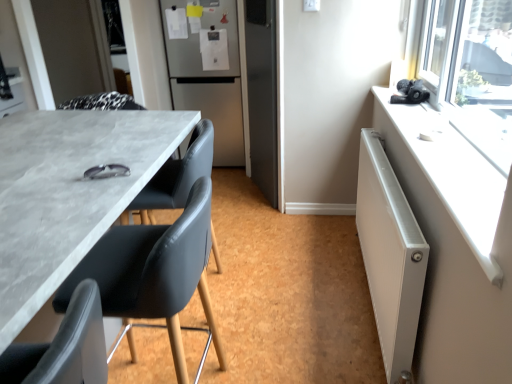
This screenshot has width=512, height=384. Describe the element at coordinates (154, 273) in the screenshot. I see `matte black chair at left, positioned as the second chair in front-to-back order` at that location.

What do you see at coordinates (177, 175) in the screenshot? I see `matte black chair at center, which appears as the 1th chair when viewed from the back` at bounding box center [177, 175].

Image resolution: width=512 pixels, height=384 pixels. Identify the location of matte black chair at center, which appears as the 1th chair when viewed from the back. (177, 175).

The width and height of the screenshot is (512, 384). I want to click on satin silver refrigerator at center, so click(x=209, y=72).

The image size is (512, 384). What do you see at coordinates (390, 255) in the screenshot?
I see `white metallic radiator at right` at bounding box center [390, 255].

Describe the element at coordinates (68, 193) in the screenshot. The height and width of the screenshot is (384, 512). I see `matte gray table at left` at that location.

This screenshot has width=512, height=384. Identify the location of matte black chair at left, positioned as the second chair in front-to-back order. (154, 273).

Is white plastic radiator at upper right situated inside matte black chair at left, positioned as the second chair in front-to-back order, or outside?

white plastic radiator at upper right is not enclosed by matte black chair at left, positioned as the second chair in front-to-back order.

Is white plastic radiator at upper right next to matte black chair at left, positioned as the second chair in front-to-back order, and touching it?

white plastic radiator at upper right is not next to matte black chair at left, positioned as the second chair in front-to-back order, and they're not touching.

From the image's perspective, is white plastic radiator at upper right over matte black chair at left, positioned as the second chair in front-to-back order?

Correct, white plastic radiator at upper right appears higher than matte black chair at left, positioned as the second chair in front-to-back order, in the image.

Which is in front, point (375, 126) or point (190, 223)?

The point (190, 223) is more forward.

Which object is wider, satin silver refrigerator at center or matte black chair at left, positioned as the second chair in front-to-back order?

With larger width is satin silver refrigerator at center.

From a real-world perspective, count 2nd chairs downward from the satin silver refrigerator at center and point to it. Please provide its 2D coordinates.

[(154, 273)]

Is satin silver refrigerator at center aimed at matte black chair at left, arranged as the 2th chair when viewed from the back?

Yes, satin silver refrigerator at center faces towards matte black chair at left, arranged as the 2th chair when viewed from the back.

Between satin silver refrigerator at center and matte black chair at left, positioned as the second chair in front-to-back order, which one has smaller size?

Smaller between the two is matte black chair at left, positioned as the second chair in front-to-back order.

From a real-world perspective, is matte gray table at left located higher than black leather chair at lower left, which appears as the 3th chair when viewed from the back?

Incorrect, from a real-world perspective, matte gray table at left is lower than black leather chair at lower left, which appears as the 3th chair when viewed from the back.

Which object is closer to the camera taking this photo, matte gray table at left or black leather chair at lower left, the 1th chair when ordered from front to back?

black leather chair at lower left, the 1th chair when ordered from front to back, is closer to the camera.

Considering the relative sizes of matte gray table at left and black leather chair at lower left, which appears as the 3th chair when viewed from the back, in the image provided, is matte gray table at left bigger than black leather chair at lower left, which appears as the 3th chair when viewed from the back,?

Yes.

Which is correct: matte gray table at left is inside black leather chair at lower left, the 1th chair when ordered from front to back, or outside of it?

matte gray table at left exists outside the volume of black leather chair at lower left, the 1th chair when ordered from front to back.

From a real-world perspective, who is located lower, matte black chair at left, arranged as the 2th chair when viewed from the back, or white metallic radiator at right?

white metallic radiator at right is physically lower.

Can you confirm if matte black chair at left, positioned as the second chair in front-to-back order, is bigger than white metallic radiator at right?

Indeed, matte black chair at left, positioned as the second chair in front-to-back order, has a larger size compared to white metallic radiator at right.

Is matte black chair at left, positioned as the second chair in front-to-back order, positioned before white metallic radiator at right?

Yes, matte black chair at left, positioned as the second chair in front-to-back order, is in front of white metallic radiator at right.

From the image's perspective, is matte black chair at left, arranged as the 2th chair when viewed from the back, located above white metallic radiator at right?

No, from the image's perspective, matte black chair at left, arranged as the 2th chair when viewed from the back, is not above white metallic radiator at right.

Based on the photo, from a real-world perspective, is white plastic radiator at upper right physically below matte gray table at left?

Actually, white plastic radiator at upper right is physically above matte gray table at left in the real world.

Considering the relative sizes of white plastic radiator at upper right and matte gray table at left in the image provided, is white plastic radiator at upper right bigger than matte gray table at left?

No.

Does white plastic radiator at upper right turn towards matte gray table at left?

Yes, white plastic radiator at upper right is oriented towards matte gray table at left.

How much distance is there between white plastic radiator at upper right and matte gray table at left?

white plastic radiator at upper right is 3.71 feet away from matte gray table at left.

In the scene shown: Is satin silver refrigerator at center oriented away from matte gray table at left?

That's not correct — satin silver refrigerator at center is not looking away from matte gray table at left.

Is point (180, 4) behind point (10, 208)?

Yes, it is behind point (10, 208).

Does satin silver refrigerator at center have a larger size compared to matte gray table at left?

No, satin silver refrigerator at center is not bigger than matte gray table at left.

Between satin silver refrigerator at center and matte gray table at left, which one has larger width?

matte gray table at left.

From the image's perspective, is black leather chair at lower left, the 1th chair when ordered from front to back, on matte black chair at left, positioned as the second chair in front-to-back order?

Yes, from the image's perspective, black leather chair at lower left, the 1th chair when ordered from front to back, is above matte black chair at left, positioned as the second chair in front-to-back order.

Which is further, (13, 366) or (136, 244)?

The point (136, 244) is farther.

In the scene shown: Between black leather chair at lower left, the 1th chair when ordered from front to back, and matte black chair at left, positioned as the second chair in front-to-back order, which one appears on the left side from the viewer's perspective?

black leather chair at lower left, the 1th chair when ordered from front to back.

Relative to matte black chair at left, positioned as the second chair in front-to-back order, is black leather chair at lower left, which appears as the 3th chair when viewed from the back, in front or behind?

Visually, black leather chair at lower left, which appears as the 3th chair when viewed from the back, is located in front of matte black chair at left, positioned as the second chair in front-to-back order.

Where is `counter top in front of the matte black chair at left, positioned as the second chair in front-to-back order`? counter top in front of the matte black chair at left, positioned as the second chair in front-to-back order is located at coordinates (445, 174).

Identify the location of refrigerator on the left of matte black chair at left, positioned as the second chair in front-to-back order. This screenshot has width=512, height=384. (209, 72).

Looking at the image, which one is located closer to white metallic radiator at right, satin silver refrigerator at center or black leather chair at lower left, which appears as the 3th chair when viewed from the back?

Among the two, black leather chair at lower left, which appears as the 3th chair when viewed from the back, is located nearer to white metallic radiator at right.

Looking at the image, which one is located closer to matte black chair at left, arranged as the 2th chair when viewed from the back, matte gray table at left or white plastic radiator at upper right?

Based on the image, matte gray table at left appears to be nearer to matte black chair at left, arranged as the 2th chair when viewed from the back.

Estimate the real-world distances between objects in this image. Which object is closer to matte black chair at left, arranged as the 2th chair when viewed from the back, white metallic radiator at right or white plastic radiator at upper right?

Based on the image, white metallic radiator at right appears to be nearer to matte black chair at left, arranged as the 2th chair when viewed from the back.

When comparing their distances from white plastic radiator at upper right, does black leather chair at lower left, the 1th chair when ordered from front to back, or matte gray table at left seem closer?

black leather chair at lower left, the 1th chair when ordered from front to back, is closer to white plastic radiator at upper right.

When comparing their distances from matte gray table at left, does white metallic radiator at right or satin silver refrigerator at center seem further?

satin silver refrigerator at center is further to matte gray table at left.

Looking at the image, which one is located further to matte black chair at left, positioned as the second chair in front-to-back order, satin silver refrigerator at center or white plastic radiator at upper right?

satin silver refrigerator at center is further to matte black chair at left, positioned as the second chair in front-to-back order.

Looking at the image, which one is located closer to matte black chair at left, arranged as the 2th chair when viewed from the back, matte black chair at center, which appears as the third chair when viewed from the front, or black leather chair at lower left, which appears as the 3th chair when viewed from the back?

black leather chair at lower left, which appears as the 3th chair when viewed from the back, lies closer to matte black chair at left, arranged as the 2th chair when viewed from the back, than the other object.

From the image, which object appears to be nearer to white metallic radiator at right, matte black chair at left, arranged as the 2th chair when viewed from the back, or matte gray table at left?

The object closer to white metallic radiator at right is matte black chair at left, arranged as the 2th chair when viewed from the back.

You are a GUI agent. You are given a task and a screenshot of the screen. Output one action in this format:
    pyautogui.click(x=<x>, y=<y>)
    Task: Click on the chair located between matte black chair at center, which appears as the 1th chair when viewed from the back, and white metallic radiator at right in the left-right direction
    
    Given the screenshot: What is the action you would take?
    pyautogui.click(x=154, y=273)

Where is `desk located between black leather chair at lower left, the 1th chair when ordered from front to back, and satin silver refrigerator at center in the depth direction`? desk located between black leather chair at lower left, the 1th chair when ordered from front to back, and satin silver refrigerator at center in the depth direction is located at coordinates (68, 193).

At what (x,y) coordinates should I click in order to perform the action: click on radiator between matte black chair at left, arranged as the 2th chair when viewed from the back, and white plastic radiator at upper right from left to right. Please return your answer as a coordinate pair (x, y). This screenshot has height=384, width=512. Looking at the image, I should click on (390, 255).

Where is `chair positioned between matte gray table at left and matte black chair at center, which appears as the 1th chair when viewed from the back, from near to far`? This screenshot has width=512, height=384. chair positioned between matte gray table at left and matte black chair at center, which appears as the 1th chair when viewed from the back, from near to far is located at coordinates (154, 273).